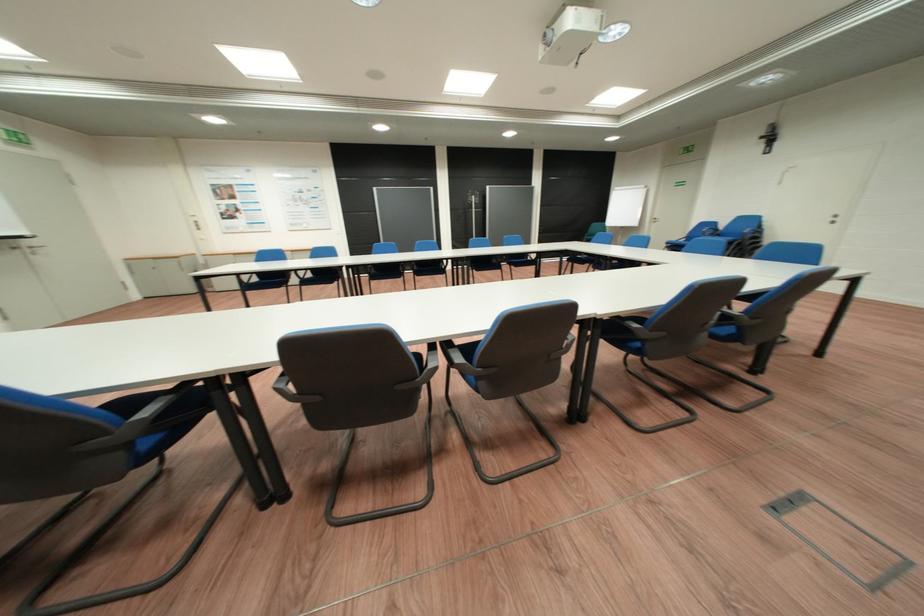
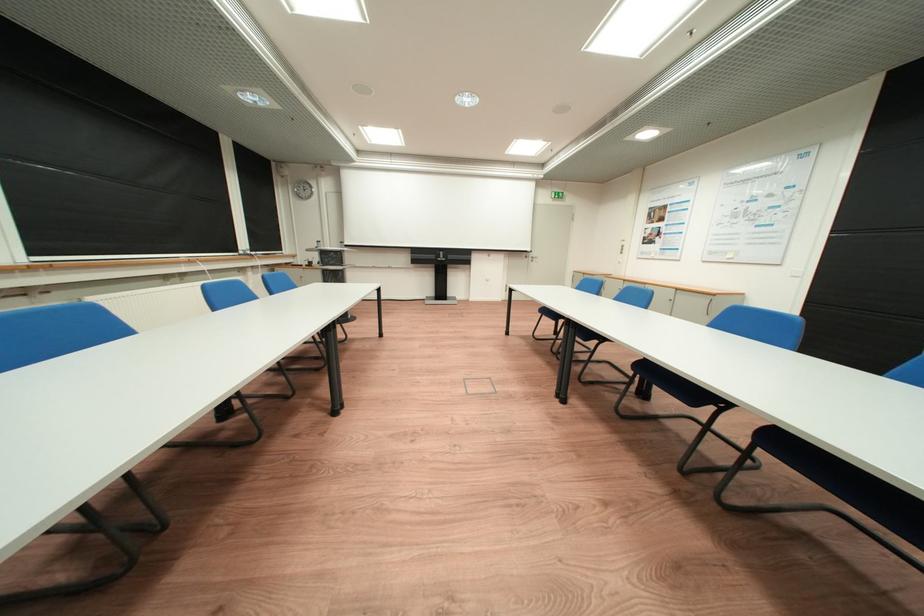
Question: I am providing you with two images of the same scene from different viewpoints. Which of the following objects are not visible in image2?

Choices:
 (A) projector screen handle
 (B) metal trash bin
 (C) black chair armrest
 (D) door handle

Answer: (C)